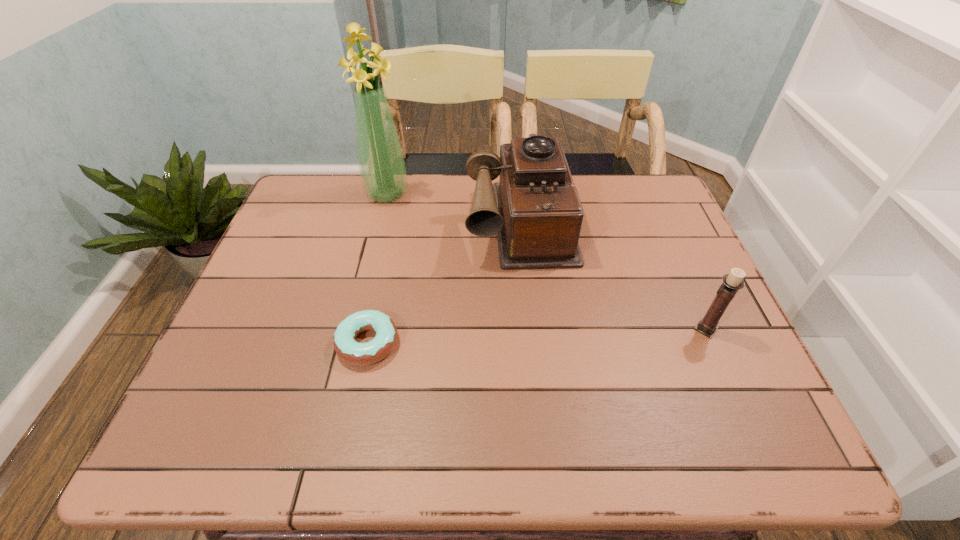
Image resolution: width=960 pixels, height=540 pixels. In order to click on free point between the shortest object and the second shortest object in this screenshot , I will do `click(537, 336)`.

Locate an element on the screen. blank region between the tallest object and the second object from right to left is located at coordinates (453, 206).

The image size is (960, 540). I want to click on vacant area between the phonograph_record and the doughnut, so click(x=444, y=281).

At what (x,y) coordinates should I click in order to perform the action: click on the third closest object to the phonograph_record. Please return your answer as a coordinate pair (x, y). This screenshot has height=540, width=960. Looking at the image, I should click on (732, 282).

Locate an element on the screen. object that is the nearest to the doughnut is located at coordinates (535, 211).

Locate an element on the screen. The height and width of the screenshot is (540, 960). vacant point that satisfies the following two spatial constraints: 1. on the front side of the bouquet; 2. on the right side of the third shortest object is located at coordinates (380, 219).